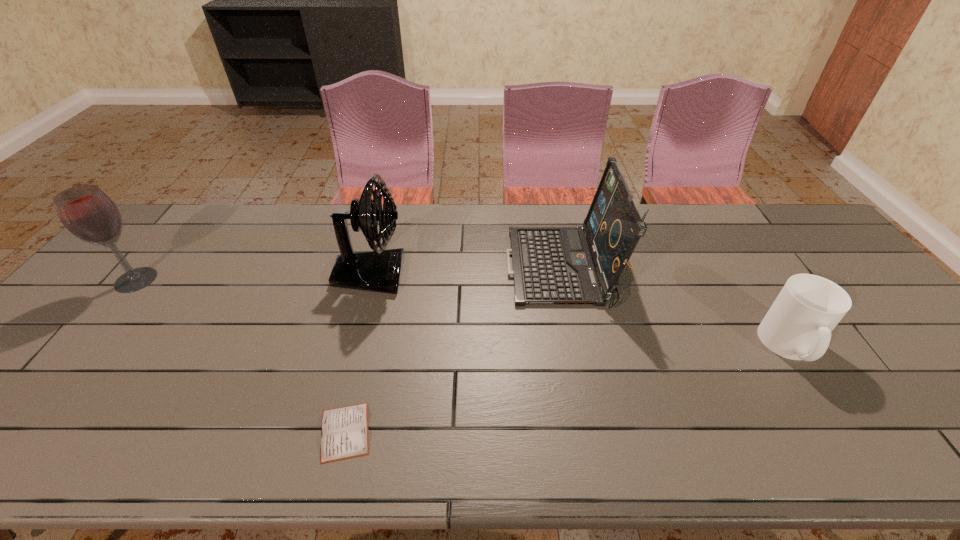
Locate an element on the screen. The image size is (960, 540). fan is located at coordinates pos(379,270).

The width and height of the screenshot is (960, 540). I want to click on laptop computer, so click(x=551, y=265).

This screenshot has height=540, width=960. Find the location of `the leftmost object`. the leftmost object is located at coordinates (88, 213).

This screenshot has height=540, width=960. I want to click on mug, so click(x=798, y=325).

In order to click on the fourth farthest object in this screenshot , I will do `click(798, 325)`.

At what (x,y) coordinates should I click in order to perform the action: click on the shortest object. Please return your answer as a coordinate pair (x, y). The image size is (960, 540). Looking at the image, I should click on (344, 430).

The image size is (960, 540). What are the coordinates of `the nearest object` in the screenshot? It's located at (344, 430).

The image size is (960, 540). I want to click on vacant space located in front of the fan to blow air, so (430, 274).

Where is `free space located 0.190m on the front-facing side of the fourth object from left to right`? The width and height of the screenshot is (960, 540). free space located 0.190m on the front-facing side of the fourth object from left to right is located at coordinates (444, 269).

At what (x,y) coordinates should I click in order to perform the action: click on vacant space located on the front-facing side of the fourth object from left to right. Please return your answer as a coordinate pair (x, y). This screenshot has height=540, width=960. Looking at the image, I should click on (400, 269).